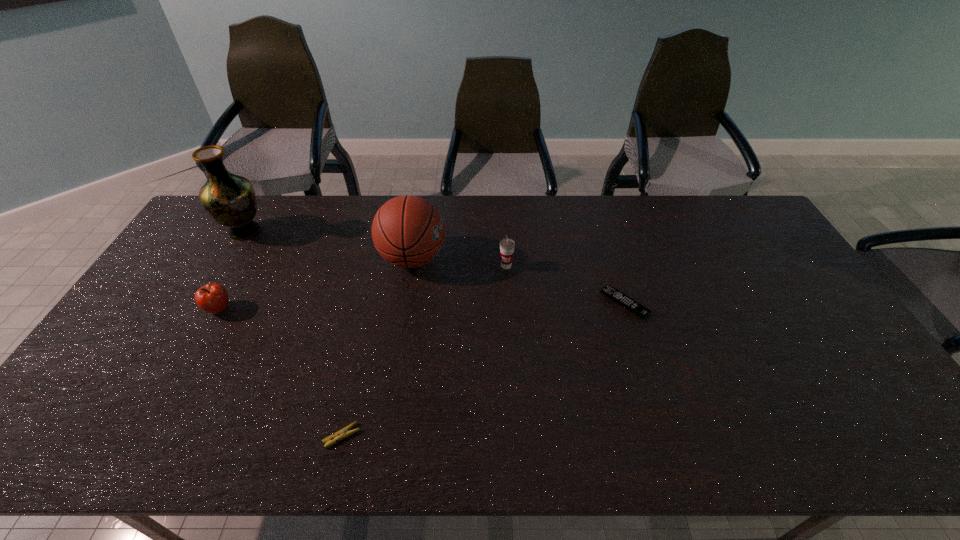
Find the location of `free point at the left edge`. free point at the left edge is located at coordinates (91, 404).

Locate an element on the screen. The width and height of the screenshot is (960, 540). vacant space at the far right corner is located at coordinates (739, 217).

This screenshot has height=540, width=960. Identify the location of empty space that is in between the clothespin and the remote control. (483, 369).

Where is `vacant region between the clothespin and the fourth tallest object`? This screenshot has width=960, height=540. vacant region between the clothespin and the fourth tallest object is located at coordinates (280, 373).

Where is `vacant area between the nearest object and the fifth object from left to right`? The width and height of the screenshot is (960, 540). vacant area between the nearest object and the fifth object from left to right is located at coordinates (424, 351).

Where is `free space that is in between the rightmost object and the tallest object`? free space that is in between the rightmost object and the tallest object is located at coordinates (435, 267).

Find the location of a particular element. empty space that is in between the vase and the rightmost object is located at coordinates (435, 267).

This screenshot has height=540, width=960. I want to click on free point between the nearest object and the tallest object, so click(293, 334).

Image resolution: width=960 pixels, height=540 pixels. In order to click on empty space that is in between the rightmost object and the clothespin in this screenshot , I will do `click(483, 369)`.

Identify the location of free space between the clothespin and the vase. (293, 334).